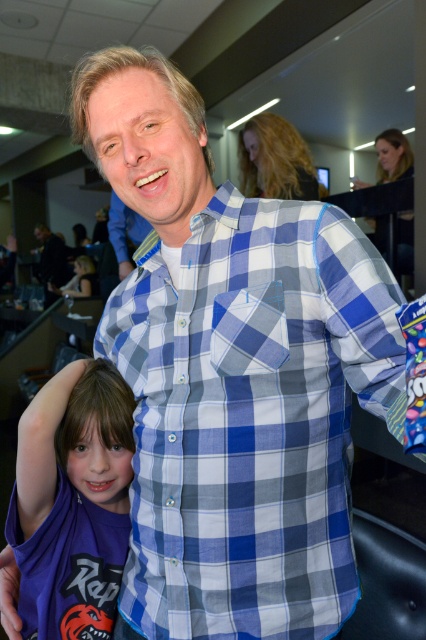
You are a photographer setting up for a group photo. You notice the blue plaid shirt at center and the purple matte shirt at lower left. Which shirt should you adjust to ensure both are visible in the frame, considering their sizes?

The blue plaid shirt at center has a larger width than the purple matte shirt at lower left, so you should adjust the blue plaid shirt at center to ensure both are visible in the frame.

You are a photographer trying to capture a candid shot of both the blue plaid shirt at center and the purple matte shirt at lower left. Since you want to ensure both are clearly visible, which shirt should you focus on first to account for their sizes?

The blue plaid shirt at center is bigger than the purple matte shirt at lower left, so you should focus on the blue plaid shirt at center first as it requires more attention due to its larger size to ensure clarity.

Based on the scene described, which object is taller between the blue plaid shirt at center and the purple matte shirt at lower left?

The blue plaid shirt at center is taller than the purple matte shirt at lower left according to the description.